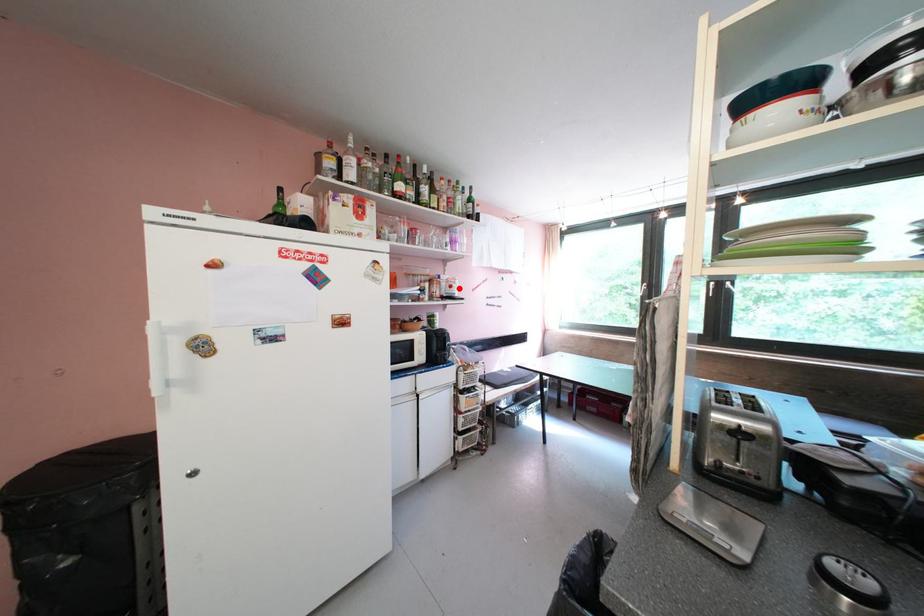
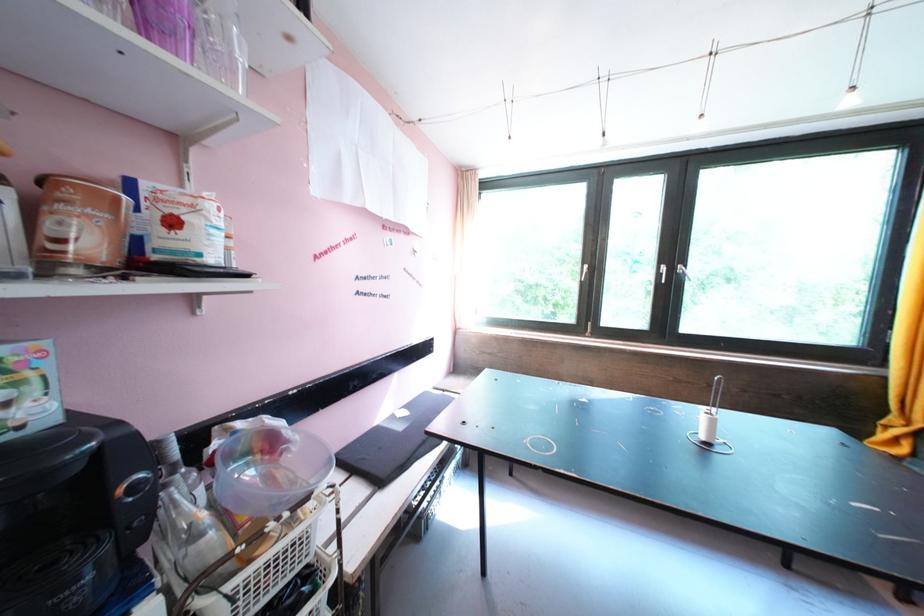
Where in the second image is the point corresponding to the highlighted location from the first image?

(181, 225)